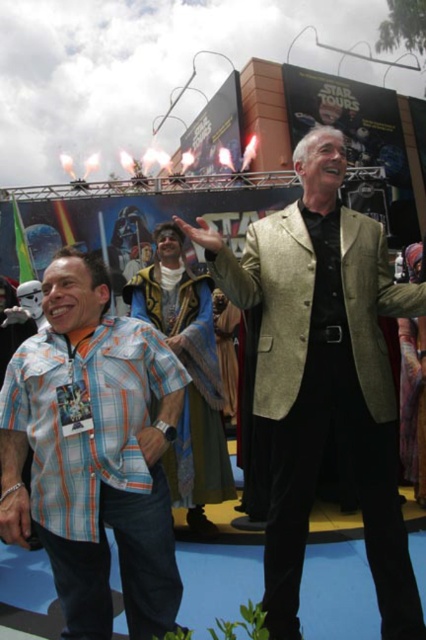
You are organizing a photo shoot and need to ensure that the two main subjects, the gold textured coat at center and the plaid cotton shirt at left, can fit side by side within a 2.5 meter wide backdrop. Given their sizes, will they fit comfortably without overlapping?

The gold textured coat at center is wider than the plaid cotton shirt at left. Since the total width of both items combined would exceed 2.5 meters, they might not fit comfortably side by side without overlapping.

You are taking a photo of the event and want to focus on both point [296,339] and point [221,417]. Which point should you focus on first to ensure both are in sharp focus?

You should focus on point [296,339] first because it is closer to the camera than point [221,417], ensuring the depth of field captures both points clearly.

You are a photographer at the Star Tours event and need to position two models so that one stands in front of the other without blocking the view. The models are wearing the gold textured coat at center and the velvet blue robe at center. Which model should stand in front to ensure the other is fully visible?

The velvet blue robe at center should stand in front because the gold textured coat at center is taller. Placing the shorter velvet blue robe at center in front will prevent it from blocking the taller gold textured coat at center behind.